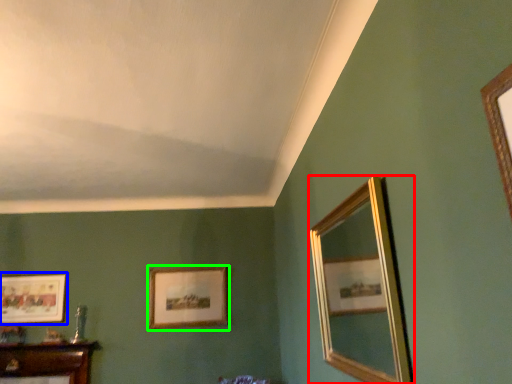
Question: Considering the real-world distances, which object is closest to mirror (highlighted by a red box)? picture frame (highlighted by a blue box) or picture frame (highlighted by a green box).

Choices:
 (A) picture frame
 (B) picture frame

Answer: (B)